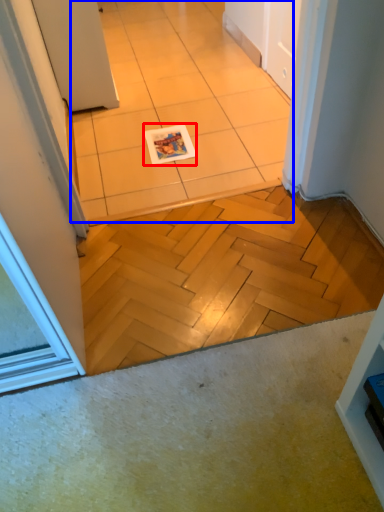
Question: Which point is further to the camera, magazine (highlighted by a red box) or ceramic tile (highlighted by a blue box)?

Choices:
 (A) magazine
 (B) ceramic tile

Answer: (A)